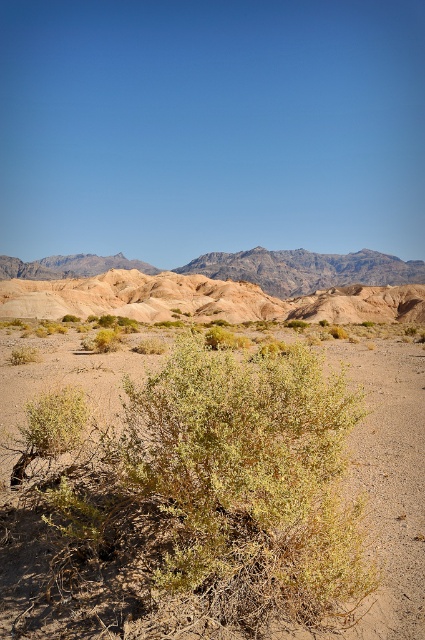
Does brown sandy bush at center come in front of rugged sandstone mountain at upper center?

That is True.

Is brown sandy bush at center positioned at the back of rugged sandstone mountain at upper center?

That is False.

Between point (325, 410) and point (396, 285), which one is positioned in front?

Point (325, 410) is more forward.

Find the location of `brown sandy bush at center`. brown sandy bush at center is located at coordinates (231, 506).